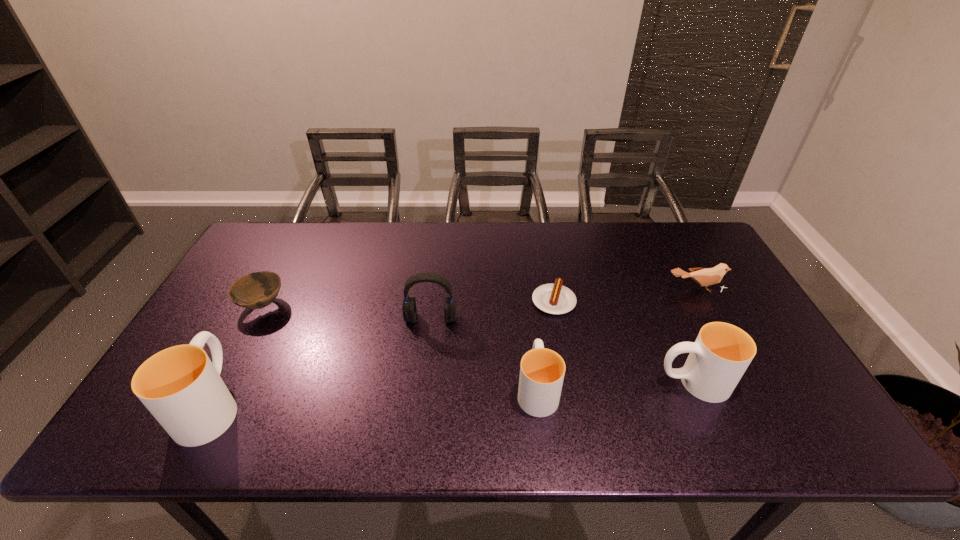
You are a GUI agent. You are given a task and a screenshot of the screen. Output one action in this format:
    pyautogui.click(x=<x>, y=<y>)
    Task: Click on the leftmost cup
    This screenshot has width=960, height=540.
    Given the screenshot: What is the action you would take?
    pyautogui.click(x=180, y=386)

Where is `the second cup from right to left`? the second cup from right to left is located at coordinates (542, 370).

The width and height of the screenshot is (960, 540). I want to click on the shortest cup, so click(x=542, y=370).

In order to click on the second tallest cup in this screenshot , I will do (722, 352).

Image resolution: width=960 pixels, height=540 pixels. Find the location of `the shortest object`. the shortest object is located at coordinates (555, 298).

Locate an element on the screen. The image size is (960, 540). the fifth object from right to left is located at coordinates (409, 309).

You are a GUI agent. You are given a task and a screenshot of the screen. Output one action in this format:
    pyautogui.click(x=<x>, y=<y>)
    Task: Click on the second shortest object
    
    Given the screenshot: What is the action you would take?
    pyautogui.click(x=257, y=290)

Identify the location of the third shortest object. (704, 276).

I want to click on free space located with the handle on the side of the leftmost cup, so click(254, 324).

Find the location of `vacant space located 0.350m with the handle on the side of the leftmost cup`. vacant space located 0.350m with the handle on the side of the leftmost cup is located at coordinates (279, 276).